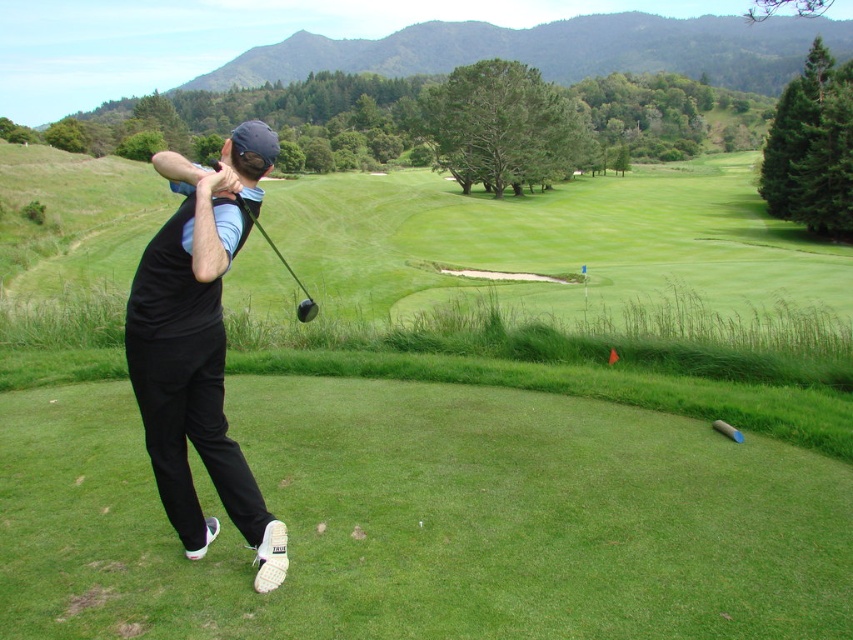
Can you confirm if black matte golf club at center is positioned to the right of shiny black golf club at center?

Correct, you'll find black matte golf club at center to the right of shiny black golf club at center.

Which is behind, point (184, 518) or point (308, 298)?

Point (308, 298)

This screenshot has height=640, width=853. Describe the element at coordinates (199, 348) in the screenshot. I see `black matte golf club at center` at that location.

Locate an element on the screen. The height and width of the screenshot is (640, 853). black matte golf club at center is located at coordinates (199, 348).